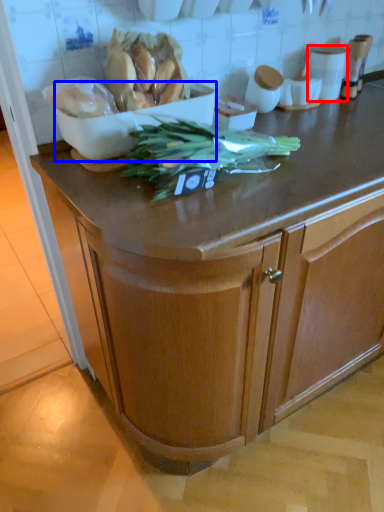
Question: Which object is further to the camera taking this photo, appliance (highlighted by a red box) or bowl (highlighted by a blue box)?

Choices:
 (A) appliance
 (B) bowl

Answer: (A)